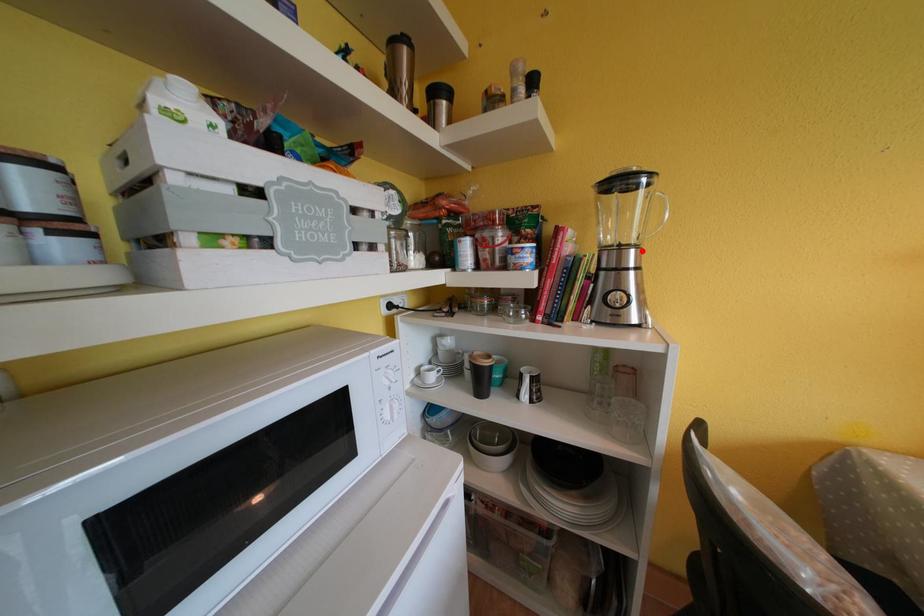
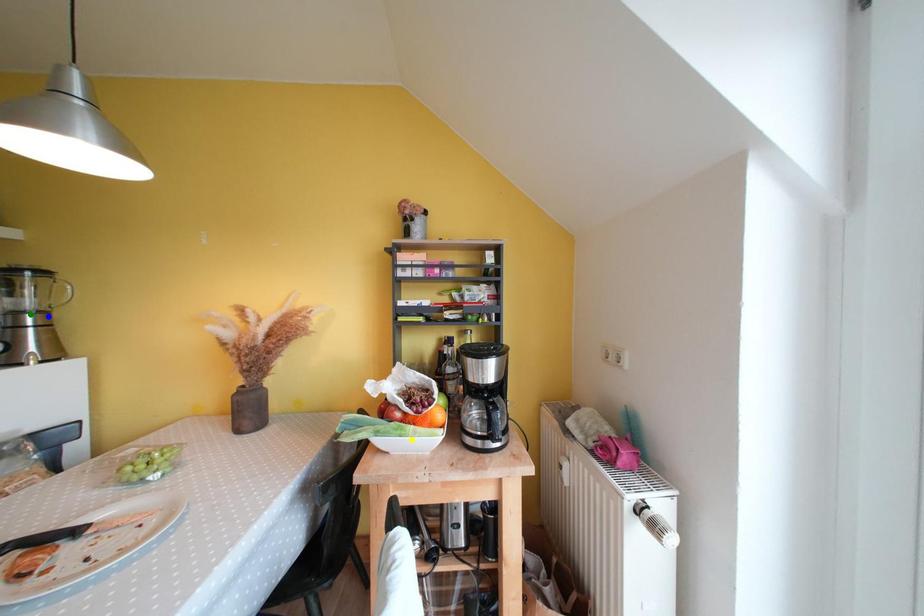
Question: I am providing you with two images of the same scene from different viewpoints. A red point is marked on the first image. You are given multiple points on the second image. Which spot in image 2 lines up with the point in image 1?

Choices:
 (A) yellow point
 (B) green point
 (C) blue point

Answer: (C)